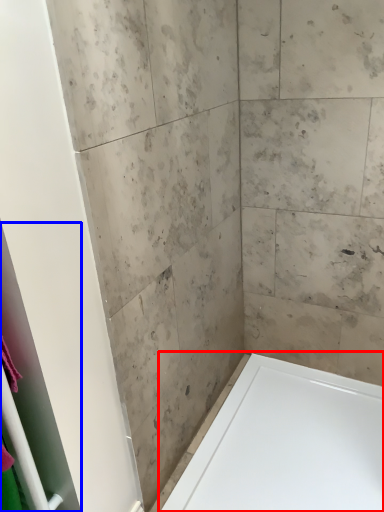
Question: Which object is further to the camera taking this photo, bathtub (highlighted by a red box) or screen door (highlighted by a blue box)?

Choices:
 (A) bathtub
 (B) screen door

Answer: (A)